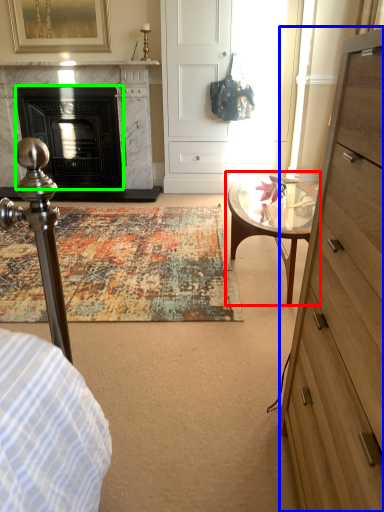
Question: Estimate the real-world distances between objects in this image. Which object is farther from coffee table (highlighted by a red box), chest of drawers (highlighted by a blue box) or fireplace (highlighted by a green box)?

Choices:
 (A) chest of drawers
 (B) fireplace

Answer: (B)